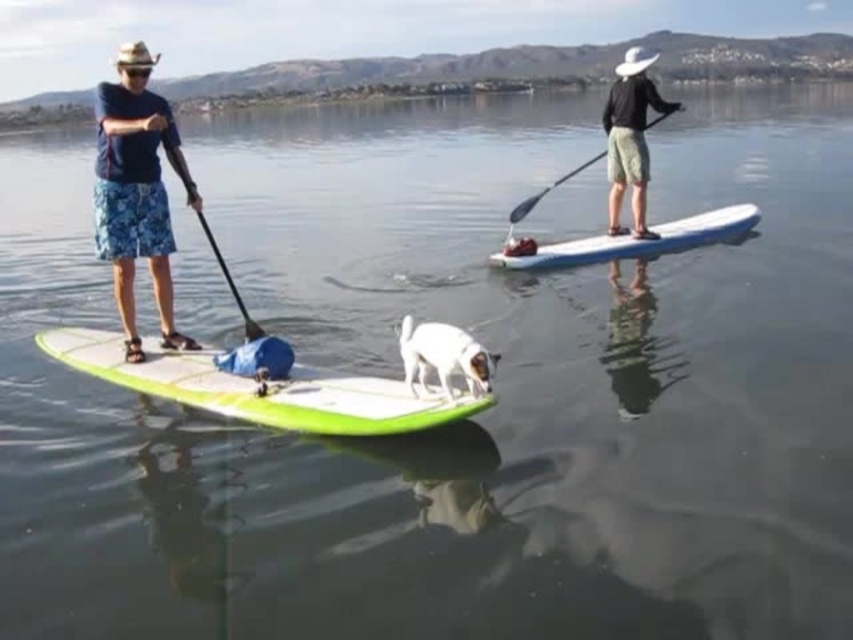
Identify the location of blue floral shorts at left. tap(136, 192).

Consider the image. Can you confirm if blue floral shorts at left is shorter than black matte paddleboarder at center?

No, blue floral shorts at left is not shorter than black matte paddleboarder at center.

Who is more distant from viewer, [112,128] or [611,228]?

Point [611,228]

You are a GUI agent. You are given a task and a screenshot of the screen. Output one action in this format:
    pyautogui.click(x=<x>, y=<y>)
    Task: Click on the blue floral shorts at left
    Image resolution: width=853 pixels, height=640 pixels.
    Given the screenshot: What is the action you would take?
    pyautogui.click(x=136, y=192)

Can you confirm if green foam surfboard at center is thinner than black smooth paddle at upper right?

In fact, green foam surfboard at center might be wider than black smooth paddle at upper right.

The image size is (853, 640). What are the coordinates of `green foam surfboard at center` in the screenshot? It's located at (265, 390).

From the picture: Can you confirm if white glossy paddleboard at center is shorter than black smooth paddle at upper right?

Indeed, white glossy paddleboard at center has a lesser height compared to black smooth paddle at upper right.

Which is behind, point (711, 240) or point (529, 205)?

The point (711, 240) is more distant.

At what (x,y) coordinates should I click in order to perform the action: click on white glossy paddleboard at center. Please return your answer as a coordinate pair (x, y). Image resolution: width=853 pixels, height=640 pixels. Looking at the image, I should click on coord(637,241).